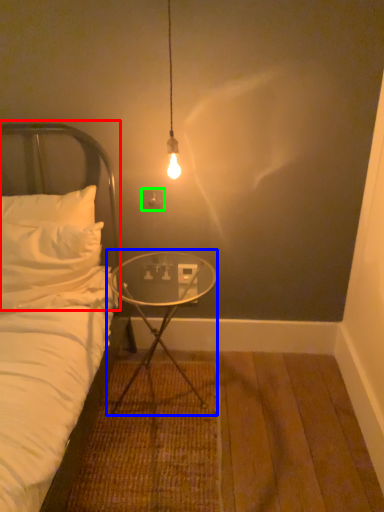
Question: Estimate the real-world distances between objects in this image. Which object is farther from headboard (highlighted by a red box), table (highlighted by a blue box) or electric outlet (highlighted by a green box)?

Choices:
 (A) table
 (B) electric outlet

Answer: (A)